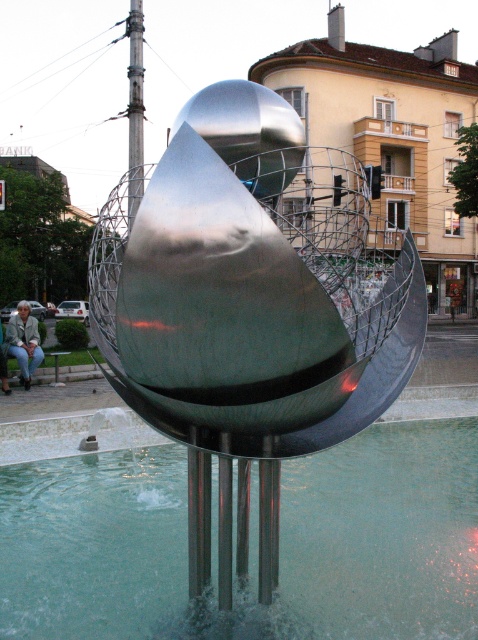
You are an artist planning to photograph the polished metal sculpture at center and the denim jacket at lower left. Since you want both subjects to appear equally prominent in the photo, which object should you move closer to the camera?

You should move the denim jacket at lower left closer to the camera because the polished metal sculpture at center is larger in size, so bringing the smaller denim jacket at lower left nearer will balance their prominence in the photograph.

You are a photographer standing at the edge of the plaza. You want to take a photo of the polished metal sculpture at center while including the denim jacket at lower left in the frame. Given that your camera has a maximum zoom range of 10 meters, can you capture both objects in a single shot without moving your position?

The distance between the polished metal sculpture at center and the denim jacket at lower left is 12.57 meters. Since your camera can only zoom up to 10 meters, you cannot capture both objects in a single shot without moving your position.